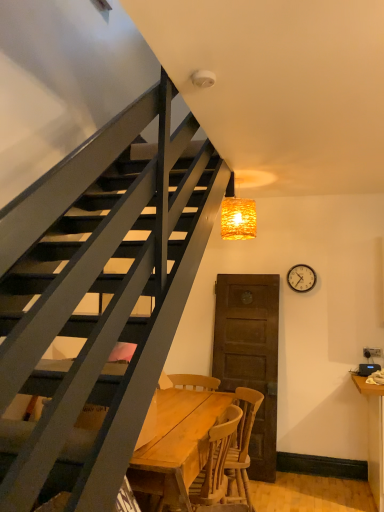
What do you see at coordinates (233, 461) in the screenshot? I see `wooden chair at center` at bounding box center [233, 461].

Measure the distance between wooden chair at center and camera.

2.37 meters.

Identify the location of metallic silver clock at upper right. (301, 278).

Measure the distance between wooden table at center and camera.

wooden table at center is 6.50 feet away from camera.

I want to click on wooden chair at center, so click(x=233, y=461).

Is wooden table at center closer to camera compared to woven golden light at upper center?

Yes, wooden table at center is closer to the camera.

Does wooden table at center have a greater width compared to woven golden light at upper center?

Yes.

From the image's perspective, which is above, wooden table at center or woven golden light at upper center?

From the image's view, woven golden light at upper center is above.

From the image's perspective, is metallic silver clock at upper right positioned above or below woven golden light at upper center?

metallic silver clock at upper right is below woven golden light at upper center.

Which object is closer to the camera taking this photo, metallic silver clock at upper right or woven golden light at upper center?

woven golden light at upper center is more forward.

Is metallic silver clock at upper right oriented away from woven golden light at upper center?

No, woven golden light at upper center is not at the back of metallic silver clock at upper right.

Is metallic silver clock at upper right to the left or to the right of woven golden light at upper center in the image?

Based on their positions, metallic silver clock at upper right is located to the right of woven golden light at upper center.

You are a GUI agent. You are given a task and a screenshot of the screen. Output one action in this format:
    pyautogui.click(x=<x>, y=<y>)
    Task: Click on the clock behind the wooden table at center
    
    Given the screenshot: What is the action you would take?
    pyautogui.click(x=301, y=278)

Is point (292, 286) positioned before point (167, 445)?

No, (292, 286) is behind (167, 445).

From the image's perspective, who appears lower, metallic silver clock at upper right or wooden table at center?

wooden table at center, from the image's perspective.

Which object is wider, metallic silver clock at upper right or wooden table at center?

With larger width is wooden table at center.

Does point (243, 405) lie behind point (311, 268)?

No, (243, 405) is closer to viewer.

Which object is positioned more to the left, wooden chair at center or metallic silver clock at upper right?

wooden chair at center.

How different are the orientations of wooden chair at center and metallic silver clock at upper right in degrees?

There is a 67.5-degree angle between the facing directions of wooden chair at center and metallic silver clock at upper right.

Is wooden chair at center far from woven golden light at upper center?

Yes, wooden chair at center is far from woven golden light at upper center.

Considering the sizes of objects wooden chair at center and woven golden light at upper center in the image provided, who is shorter, wooden chair at center or woven golden light at upper center?

With less height is woven golden light at upper center.

Considering the points (251, 430) and (249, 213), which point is behind, point (251, 430) or point (249, 213)?

The point (251, 430) is behind.

Can you confirm if wooden table at center is positioned to the left of metallic silver clock at upper right?

Yes.

How far apart are wooden table at center and metallic silver clock at upper right?

A distance of 6.46 feet exists between wooden table at center and metallic silver clock at upper right.

Could you tell me if wooden table at center is turned towards metallic silver clock at upper right?

No, wooden table at center is not oriented towards metallic silver clock at upper right.

Can you confirm if wooden table at center is smaller than metallic silver clock at upper right?

No, wooden table at center is not smaller than metallic silver clock at upper right.

Is woven golden light at upper center wider than wooden chair at center?

No, woven golden light at upper center is not wider than wooden chair at center.

In the scene shown: From a real-world perspective, which is physically below, woven golden light at upper center or wooden chair at center?

In real-world perspective, wooden chair at center is lower.

Find the location of a particular element. This screenshot has width=384, height=512. lamp located on the right of wooden chair at center is located at coordinates (237, 215).

Identify the location of desk that appears below the woven golden light at upper center (from the image's perspective). Image resolution: width=384 pixels, height=512 pixels. (177, 445).

In the image, there is a woven golden light at upper center. Where is `clock below it (from a real-world perspective)`? Image resolution: width=384 pixels, height=512 pixels. clock below it (from a real-world perspective) is located at coordinates (301, 278).

When comparing their distances from wooden chair at center, does metallic silver clock at upper right or wooden table at center seem closer?

Among the two, wooden table at center is located nearer to wooden chair at center.

Estimate the real-world distances between objects in this image. Which object is closer to woven golden light at upper center, metallic silver clock at upper right or wooden table at center?

metallic silver clock at upper right.

Based on their spatial positions, is metallic silver clock at upper right or woven golden light at upper center further from wooden chair at center?

metallic silver clock at upper right.

When comparing their distances from wooden chair at center, does woven golden light at upper center or wooden table at center seem closer?

Based on the image, wooden table at center appears to be nearer to wooden chair at center.

From the image, which object appears to be farther from wooden table at center, metallic silver clock at upper right or wooden chair at center?

Based on the image, metallic silver clock at upper right appears to be further to wooden table at center.

Estimate the real-world distances between objects in this image. Which object is further from wooden chair at center, woven golden light at upper center or metallic silver clock at upper right?

metallic silver clock at upper right lies further to wooden chair at center than the other object.

Based on the photo, considering their positions, is wooden table at center positioned closer to woven golden light at upper center than wooden chair at center?

wooden table at center is positioned closer to the anchor woven golden light at upper center.

Estimate the real-world distances between objects in this image. Which object is closer to metallic silver clock at upper right, wooden table at center or wooden chair at center?

Based on the image, wooden chair at center appears to be nearer to metallic silver clock at upper right.

Identify the location of clock between woven golden light at upper center and wooden chair at center in the up-down direction. (301, 278).

You are a GUI agent. You are given a task and a screenshot of the screen. Output one action in this format:
    pyautogui.click(x=<x>, y=<y>)
    Task: Click on the desk between woven golden light at upper center and wooden chair at center vertically
    The width and height of the screenshot is (384, 512).
    Given the screenshot: What is the action you would take?
    pyautogui.click(x=177, y=445)

The width and height of the screenshot is (384, 512). I want to click on clock between woven golden light at upper center and wooden table at center in the up-down direction, so click(301, 278).

Identify the location of chair between wooden table at center and metallic silver clock at upper right from front to back. The width and height of the screenshot is (384, 512). (233, 461).